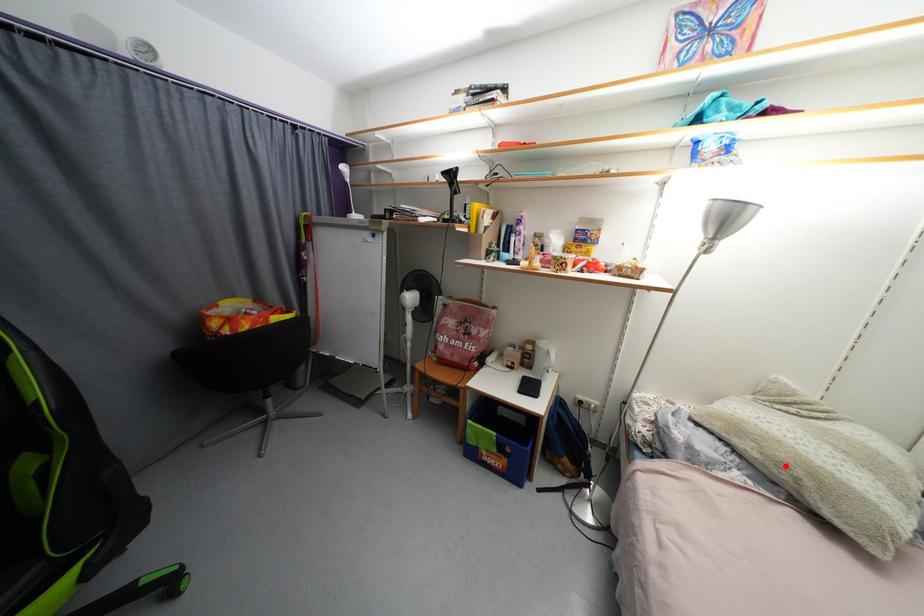
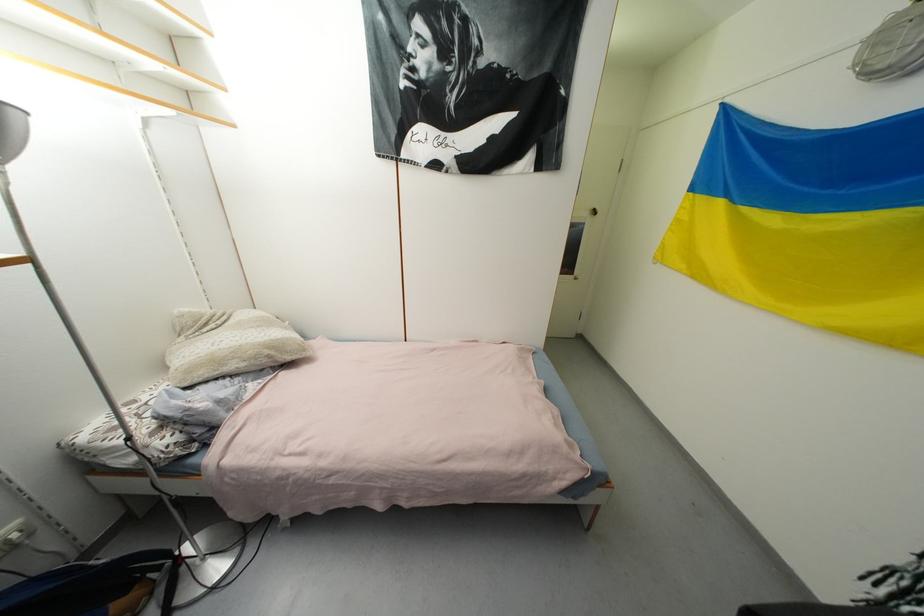
Where in the second image is the point corresponding to the highlighted location from the first image?

(261, 359)